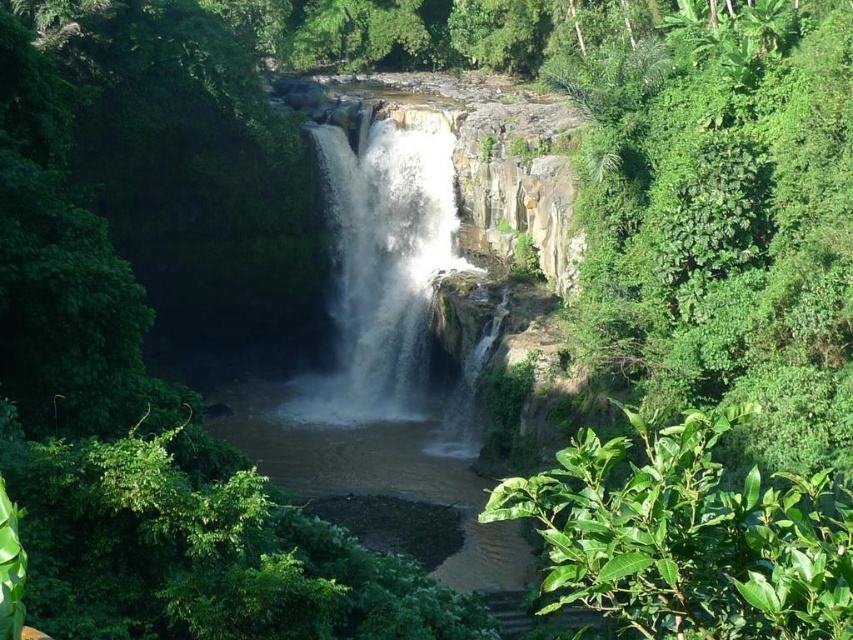
You are standing in the lush landscape and want to take a photo of the white frothy water at center without the green leafy plant at lower right blocking the view. Which direction should you move to ensure the plant is no longer in front of the water?

Move to the left or right so that the green leafy plant at lower right is no longer in front of the white frothy water at center.

You are standing at the edge of the waterfall and see the green leafy plant at lower right and the white frothy water at center. Which object is closer to the ground?

The green leafy plant at lower right is closer to the ground because it is positioned below the white frothy water at center.